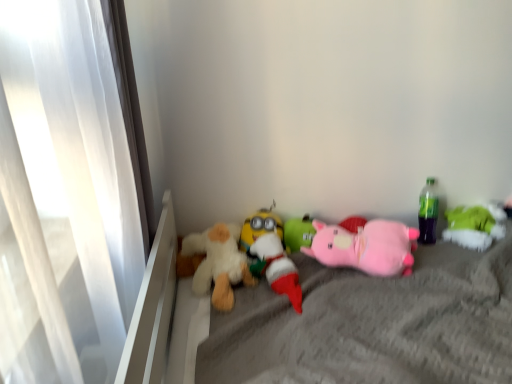
Question: From the image's perspective, is white plush toy at center, the third toy when ordered from left to right, located above pink plush pig at center, the second toy viewed from the right?

Choices:
 (A) no
 (B) yes

Answer: (A)

Question: Is white plush toy at center, which is counted as the fourth toy, starting from the right, next to pink plush pig at center, the second toy viewed from the right?

Choices:
 (A) yes
 (B) no

Answer: (B)

Question: Considering the relative sizes of white plush toy at center, which is counted as the fourth toy, starting from the right, and pink plush pig at center, the second toy viewed from the right, in the image provided, is white plush toy at center, which is counted as the fourth toy, starting from the right, smaller than pink plush pig at center, the second toy viewed from the right,?

Choices:
 (A) no
 (B) yes

Answer: (B)

Question: From the image's perspective, is white plush toy at center, which is counted as the fourth toy, starting from the right, under pink plush pig at center, the second toy viewed from the right?

Choices:
 (A) yes
 (B) no

Answer: (A)

Question: Is white plush toy at center, the third toy when ordered from left to right, further to the viewer compared to pink plush pig at center, arranged as the 5th toy when viewed from the left?

Choices:
 (A) no
 (B) yes

Answer: (A)

Question: From the image's perspective, is green plush toy at center, positioned as the third toy in right-to-left order, located above fluffy white teddy bear at center, positioned as the 6th toy in right-to-left order?

Choices:
 (A) no
 (B) yes

Answer: (B)

Question: Does green plush toy at center, positioned as the third toy in right-to-left order, have a greater height compared to fluffy white teddy bear at center, acting as the 1th toy starting from the left?

Choices:
 (A) yes
 (B) no

Answer: (B)

Question: Is green plush toy at center, marked as the 4th toy in a left-to-right arrangement, thinner than fluffy white teddy bear at center, acting as the 1th toy starting from the left?

Choices:
 (A) yes
 (B) no

Answer: (A)

Question: Can you confirm if green plush toy at center, positioned as the third toy in right-to-left order, is bigger than fluffy white teddy bear at center, acting as the 1th toy starting from the left?

Choices:
 (A) yes
 (B) no

Answer: (B)

Question: Could you tell me if green plush toy at center, marked as the 4th toy in a left-to-right arrangement, is facing fluffy white teddy bear at center, positioned as the 6th toy in right-to-left order?

Choices:
 (A) no
 (B) yes

Answer: (A)

Question: Is green plush toy at center, positioned as the third toy in right-to-left order, outside fluffy white teddy bear at center, acting as the 1th toy starting from the left?

Choices:
 (A) no
 (B) yes

Answer: (B)

Question: Can you confirm if fluffy white teddy bear at center, positioned as the 6th toy in right-to-left order, is thinner than soft gray fabric mattress at center?

Choices:
 (A) yes
 (B) no

Answer: (A)